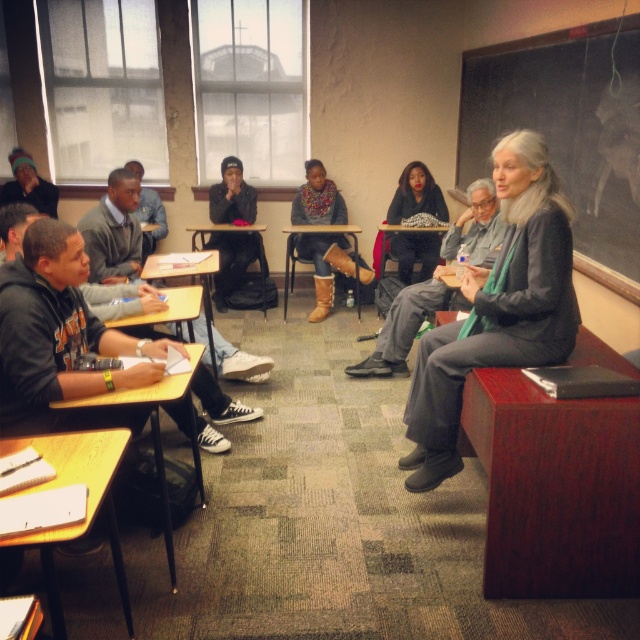
Does wooden desk at lower left appear over wooden desk at center?

No, wooden desk at lower left is not above wooden desk at center.

Is point (33, 490) positioned before point (227, 227)?

Yes, point (33, 490) is in front of point (227, 227).

Who is more distant from viewer, (76, 456) or (244, 225)?

The point (244, 225) is more distant.

Locate an element on the screen. wooden desk at lower left is located at coordinates click(x=86, y=502).

Is gray woolen sweater at center taller than black leather jacket at center?

Indeed, gray woolen sweater at center has a greater height compared to black leather jacket at center.

Between gray woolen sweater at center and black leather jacket at center, which one appears on the left side from the viewer's perspective?

black leather jacket at center is more to the left.

The image size is (640, 640). Describe the element at coordinates (497, 308) in the screenshot. I see `gray woolen sweater at center` at that location.

Image resolution: width=640 pixels, height=640 pixels. Find the location of `gray woolen sweater at center`. gray woolen sweater at center is located at coordinates point(497,308).

Is yellow wood desk at lower left positioned at the back of black leather jacket at center?

No, yellow wood desk at lower left is closer to the viewer.

The width and height of the screenshot is (640, 640). I want to click on yellow wood desk at lower left, so click(x=156, y=429).